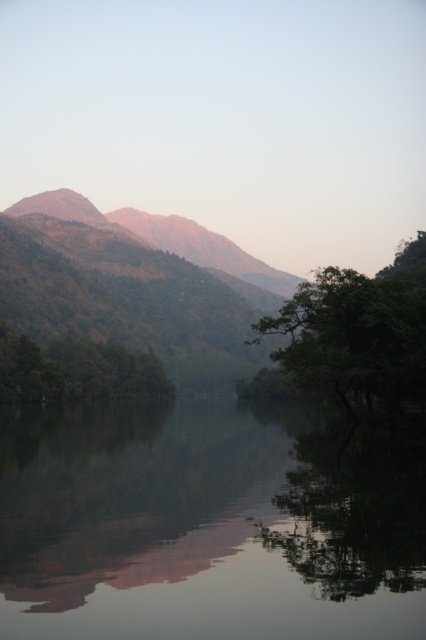
Is green leafy tree at right above green matte tree at left?

Yes.

Is green leafy tree at right in front of green matte tree at left?

Yes, green leafy tree at right is closer to the viewer.

Does point (347, 356) lie in front of point (28, 352)?

Yes, point (347, 356) is closer to viewer.

The width and height of the screenshot is (426, 640). In order to click on green leafy tree at right in this screenshot , I will do `click(359, 333)`.

Is point (201, 595) positioned before point (51, 392)?

Yes, point (201, 595) is closer to viewer.

This screenshot has width=426, height=640. Describe the element at coordinates (206, 525) in the screenshot. I see `smooth reflective water at center` at that location.

Locate an element on the screen. The image size is (426, 640). smooth reflective water at center is located at coordinates (206, 525).

Which is behind, point (348, 548) or point (405, 346)?

The point (405, 346) is more distant.

Which is in front, point (8, 560) or point (327, 355)?

Positioned in front is point (8, 560).

Locate an element on the screen. This screenshot has width=426, height=640. smooth reflective water at center is located at coordinates (206, 525).